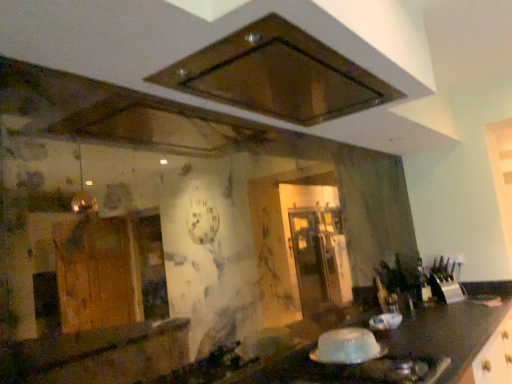
What do you see at coordinates (278, 75) in the screenshot? I see `brown matte exhaust hood at upper center` at bounding box center [278, 75].

Measure the distance between brown matte exhaust hood at upper center and camera.

3.35 feet.

The width and height of the screenshot is (512, 384). Identify the location of translucent plastic container at lower center. (346, 346).

Find the location of a particular element. brown matte exhaust hood at upper center is located at coordinates (278, 75).

Is white glossy gas stove at lower right positioned beyond the bounds of translucent plastic container at lower center?

Yes.

Between white glossy gas stove at lower right and translucent plastic container at lower center, which one has larger width?

With larger width is white glossy gas stove at lower right.

Does point (375, 368) appear closer or farther from the camera than point (358, 340)?

Point (375, 368).

From the image's perspective, is brown matte exhaust hood at upper center on top of translucent plastic container at lower center?

Indeed, from the image's perspective, brown matte exhaust hood at upper center is shown above translucent plastic container at lower center.

In terms of width, does brown matte exhaust hood at upper center look wider or thinner when compared to translucent plastic container at lower center?

brown matte exhaust hood at upper center is wider than translucent plastic container at lower center.

What's the angular difference between brown matte exhaust hood at upper center and translucent plastic container at lower center's facing directions?

brown matte exhaust hood at upper center and translucent plastic container at lower center are facing 2.39 degrees away from each other.

Is brown matte exhaust hood at upper center oriented towards translucent plastic container at lower center?

No, brown matte exhaust hood at upper center does not turn towards translucent plastic container at lower center.

In terms of height, does metallic silver knife block at right look taller or shorter compared to white glossy gas stove at lower right?

Considering their sizes, metallic silver knife block at right has more height than white glossy gas stove at lower right.

From a real-world perspective, does metallic silver knife block at right sit lower than white glossy gas stove at lower right?

Actually, metallic silver knife block at right is physically above white glossy gas stove at lower right in the real world.

Who is bigger, metallic silver knife block at right or white glossy gas stove at lower right?

white glossy gas stove at lower right is bigger.

Which is more to the left, metallic silver knife block at right or brown matte exhaust hood at upper center?

brown matte exhaust hood at upper center is more to the left.

This screenshot has width=512, height=384. Identify the location of exhaust hood in front of the metallic silver knife block at right. pyautogui.click(x=278, y=75).

From a real-world perspective, is metallic silver knife block at right physically below brown matte exhaust hood at upper center?

Indeed, from a real-world perspective, metallic silver knife block at right is positioned beneath brown matte exhaust hood at upper center.

Is metallic silver knife block at right in front of or behind brown matte exhaust hood at upper center in the image?

Visually, metallic silver knife block at right is located behind brown matte exhaust hood at upper center.

Looking at this image, does white glossy gas stove at lower right touch metallic silver knife block at right?

There is a gap between white glossy gas stove at lower right and metallic silver knife block at right.

Would you say white glossy gas stove at lower right is to the left or to the right of metallic silver knife block at right in the picture?

white glossy gas stove at lower right is positioned on metallic silver knife block at right's left side.

Which of these two, white glossy gas stove at lower right or metallic silver knife block at right, is smaller?

metallic silver knife block at right is smaller.

From a real-world perspective, is white glossy gas stove at lower right on metallic silver knife block at right?

No.

Is translucent plastic container at lower center wider or thinner than metallic silver knife block at right?

translucent plastic container at lower center is wider than metallic silver knife block at right.

From a real-world perspective, who is located higher, translucent plastic container at lower center or metallic silver knife block at right?

metallic silver knife block at right is physically above.

Is translucent plastic container at lower center far away from metallic silver knife block at right?

translucent plastic container at lower center is far away from metallic silver knife block at right.

Is point (346, 343) farther from camera compared to point (455, 300)?

That is False.

Which is behind, point (319, 345) or point (371, 374)?

The point (319, 345) is behind.

The height and width of the screenshot is (384, 512). I want to click on gas stove that is in front of the translucent plastic container at lower center, so click(375, 371).

From a real-world perspective, is translucent plastic container at lower center positioned over white glossy gas stove at lower right based on gravity?

Yes, from a real-world perspective, translucent plastic container at lower center is above white glossy gas stove at lower right.

Which of these two, translucent plastic container at lower center or white glossy gas stove at lower right, stands shorter?

With less height is white glossy gas stove at lower right.

The height and width of the screenshot is (384, 512). Identify the location of food above the white glossy gas stove at lower right (from a real-world perspective). (346, 346).

Identify the location of food that appears behind the brown matte exhaust hood at upper center. This screenshot has height=384, width=512. (346, 346).

Based on their spatial positions, is metallic silver knife block at right or white glossy gas stove at lower right closer to brown matte exhaust hood at upper center?

white glossy gas stove at lower right is positioned closer to the anchor brown matte exhaust hood at upper center.

From the picture: From the image, which object appears to be farther from white glossy gas stove at lower right, metallic silver knife block at right or brown matte exhaust hood at upper center?

The object further to white glossy gas stove at lower right is metallic silver knife block at right.

Looking at the image, which one is located further to translucent plastic container at lower center, brown matte exhaust hood at upper center or white glossy gas stove at lower right?

brown matte exhaust hood at upper center is positioned further to the anchor translucent plastic container at lower center.

Based on their spatial positions, is translucent plastic container at lower center or metallic silver knife block at right further from white glossy gas stove at lower right?

metallic silver knife block at right is further to white glossy gas stove at lower right.

Consider the image. Considering their positions, is translucent plastic container at lower center positioned further to brown matte exhaust hood at upper center than metallic silver knife block at right?

Among the two, metallic silver knife block at right is located further to brown matte exhaust hood at upper center.

When comparing their distances from white glossy gas stove at lower right, does brown matte exhaust hood at upper center or metallic silver knife block at right seem further?

metallic silver knife block at right.

Which object lies further to the anchor point metallic silver knife block at right, brown matte exhaust hood at upper center or translucent plastic container at lower center?

The object further to metallic silver knife block at right is brown matte exhaust hood at upper center.

When comparing their distances from translucent plastic container at lower center, does metallic silver knife block at right or white glossy gas stove at lower right seem further?

metallic silver knife block at right is positioned further to the anchor translucent plastic container at lower center.

You are a GUI agent. You are given a task and a screenshot of the screen. Output one action in this format:
    pyautogui.click(x=<x>, y=<y>)
    Task: Click on the food positioned between white glossy gas stove at lower right and metallic silver knife block at right from near to far
    
    Given the screenshot: What is the action you would take?
    pyautogui.click(x=346, y=346)

Locate an element on the screen. Image resolution: width=512 pixels, height=384 pixels. food between brown matte exhaust hood at upper center and white glossy gas stove at lower right from top to bottom is located at coordinates (346, 346).

This screenshot has height=384, width=512. In order to click on gas stove positioned between brown matte exhaust hood at upper center and metallic silver knife block at right from near to far in this screenshot , I will do `click(375, 371)`.

At what (x,y) coordinates should I click in order to perform the action: click on food between brown matte exhaust hood at upper center and metallic silver knife block at right along the z-axis. Please return your answer as a coordinate pair (x, y). The width and height of the screenshot is (512, 384). Looking at the image, I should click on (346, 346).